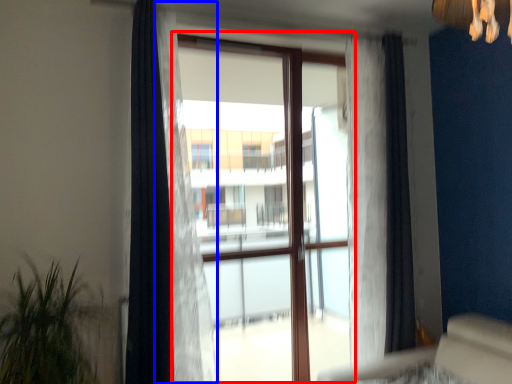
Question: Which object is further to the camera taking this photo, bay window (highlighted by a red box) or curtain (highlighted by a blue box)?

Choices:
 (A) bay window
 (B) curtain

Answer: (A)